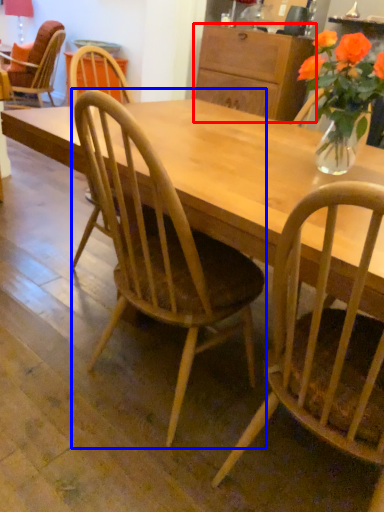
Question: Which point is further to the camera, cabinetry (highlighted by a red box) or chair (highlighted by a blue box)?

Choices:
 (A) cabinetry
 (B) chair

Answer: (A)